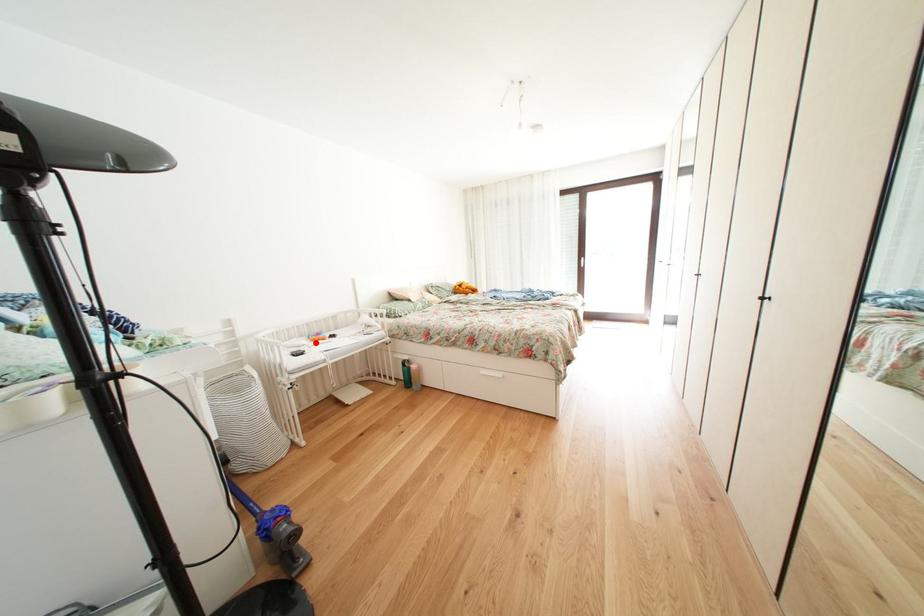
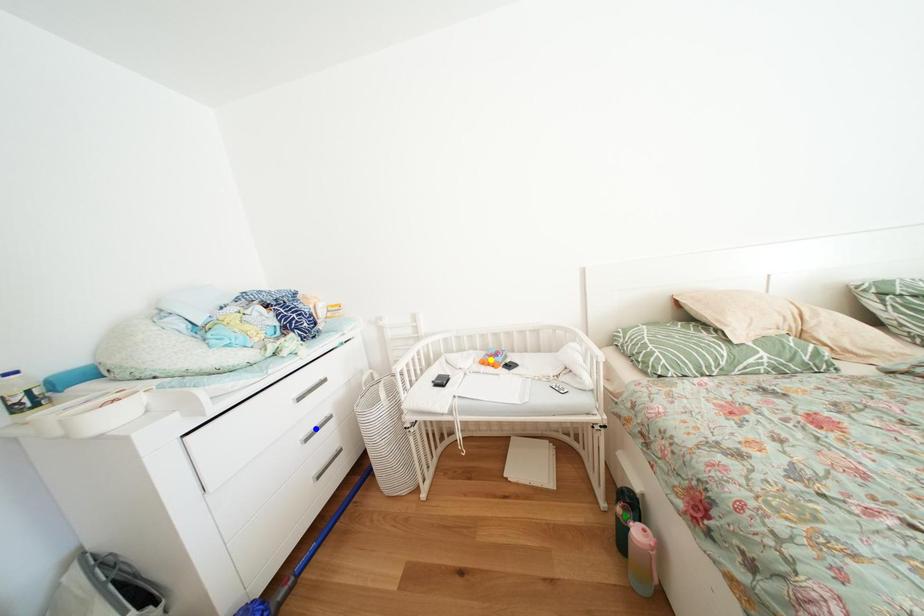
Question: I am providing you with two images of the same scene from different viewpoints. A red point is marked on the first image. You are given multiple points on the second image. Which mark in image 2 goes with the point in image 1?

Choices:
 (A) green point
 (B) yellow point
 (C) blue point

Answer: (B)